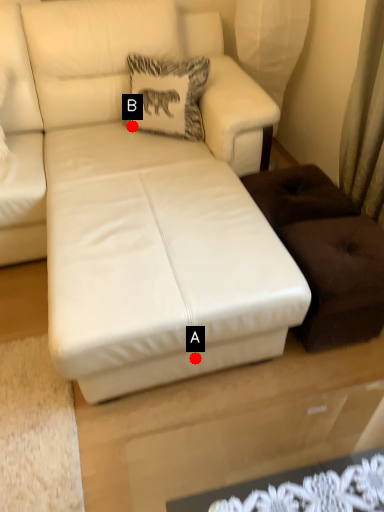
Question: Two points are circled on the image, labeled by A and B beside each circle. Which of the following is the closest to the observer?

Choices:
 (A) A is closer
 (B) B is closer

Answer: (A)